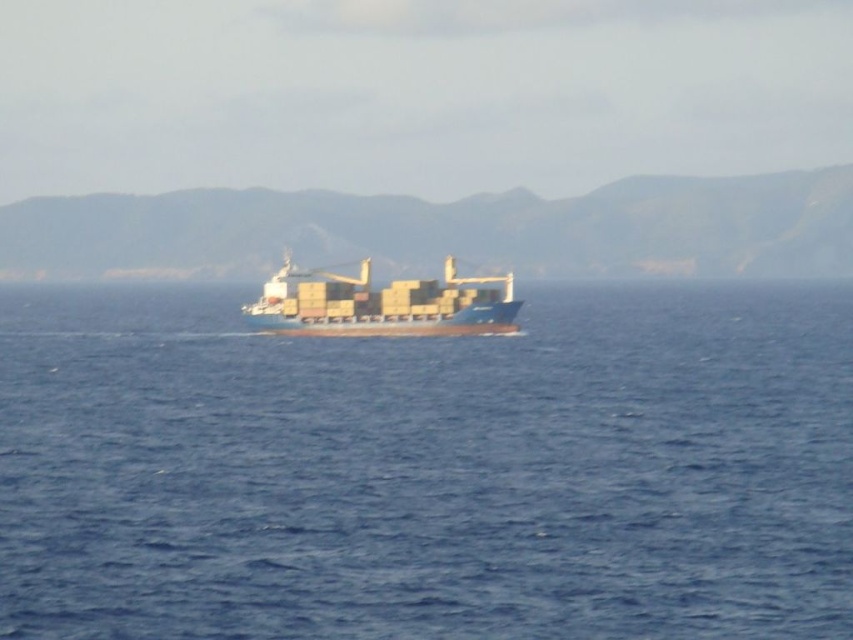
Question: Does blue water at center appear under blue matte container ship at center?

Choices:
 (A) yes
 (B) no

Answer: (A)

Question: Does blue water at center come in front of blue matte container ship at center?

Choices:
 (A) no
 (B) yes

Answer: (B)

Question: Which point is closer to the camera?

Choices:
 (A) blue water at center
 (B) blue matte container ship at center

Answer: (A)

Question: Where is blue water at center located in relation to blue matte container ship at center in the image?

Choices:
 (A) above
 (B) below

Answer: (B)

Question: Which object is closer to the camera taking this photo?

Choices:
 (A) blue water at center
 (B) blue matte container ship at center

Answer: (A)